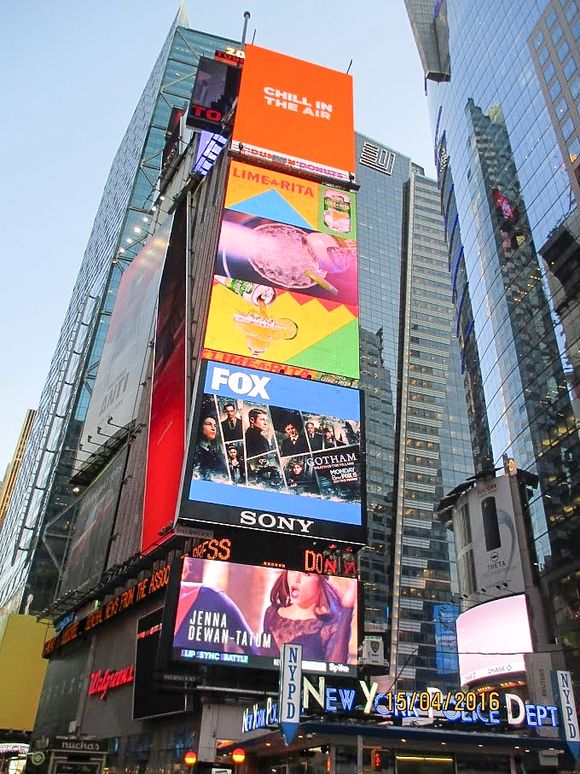
At what (x,y) coordinates should I click in order to perform the action: click on red neon sign. Please return your answer as a coordinate pair (x, y). Looking at the image, I should click on (108, 682).